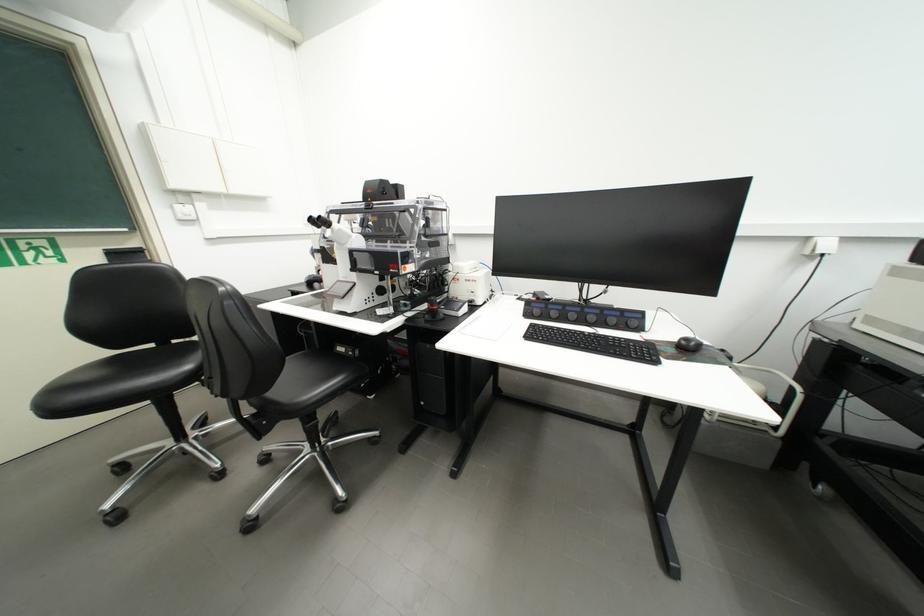
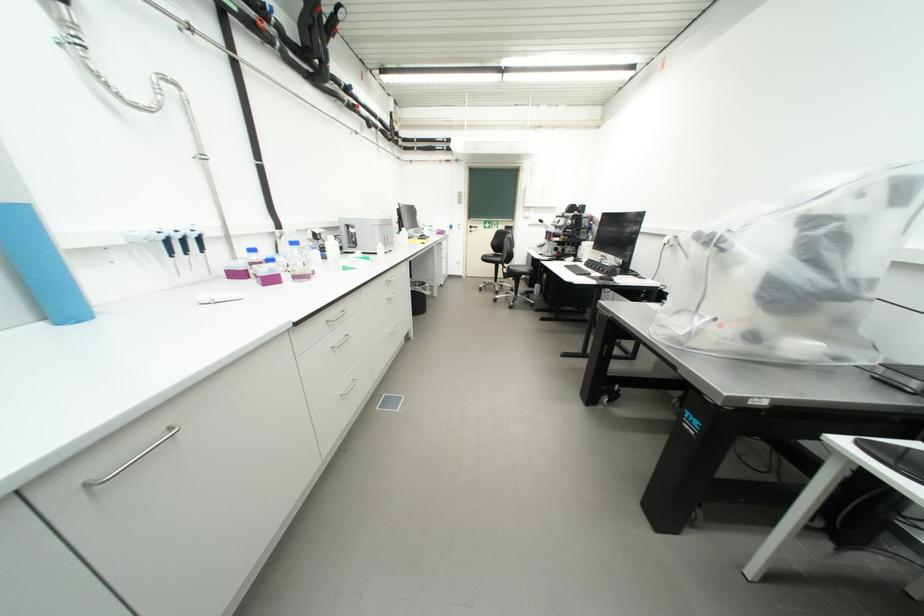
In the second image, find the point that corresponds to (x=560, y=330) in the first image.

(585, 267)